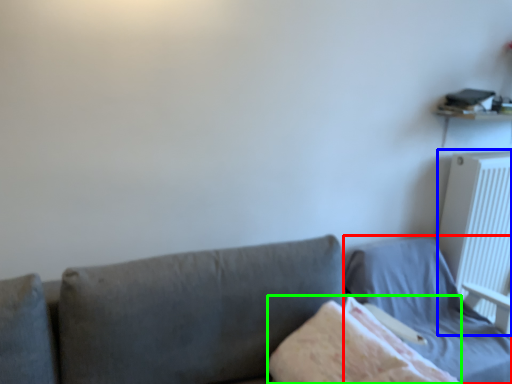
Question: Based on their relative distances, which object is nearer to bed (highlighted by a red box)? Choose from radiator (highlighted by a blue box) and blanket (highlighted by a green box).

Choices:
 (A) radiator
 (B) blanket

Answer: (A)